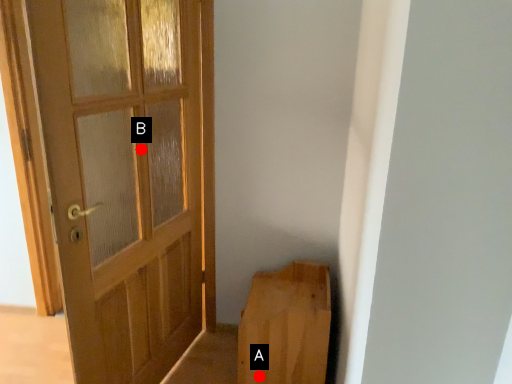
Question: Two points are circled on the image, labeled by A and B beside each circle. Which point is farther from the camera taking this photo?

Choices:
 (A) A is further
 (B) B is further

Answer: (A)